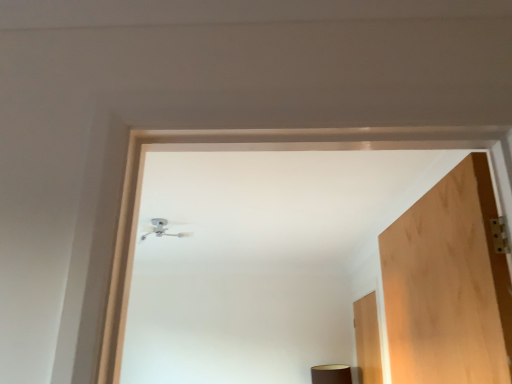
This screenshot has height=384, width=512. Describe the element at coordinates (161, 229) in the screenshot. I see `white metallic ceiling light at upper center` at that location.

You are a GUI agent. You are given a task and a screenshot of the screen. Output one action in this format:
    pyautogui.click(x=<x>, y=<y>)
    Task: Click on the white metallic ceiling light at upper center
    
    Given the screenshot: What is the action you would take?
    pyautogui.click(x=161, y=229)

What is the approximate height of white metallic ceiling light at upper center?

white metallic ceiling light at upper center is 4.21 inches in height.

What do you see at coordinates (367, 340) in the screenshot?
I see `wooden door at right` at bounding box center [367, 340].

What is the approximate height of wooden door at right?

The height of wooden door at right is 28.90 inches.

You are a GUI agent. You are given a task and a screenshot of the screen. Output one action in this format:
    pyautogui.click(x=<x>, y=<y>)
    Task: Click on the wooden door at right
    
    Given the screenshot: What is the action you would take?
    pyautogui.click(x=367, y=340)

You are a GUI agent. You are given a task and a screenshot of the screen. Output one action in this format:
    pyautogui.click(x=<x>, y=<y>)
    Task: Click on the white metallic ceiling light at upper center
    This screenshot has width=512, height=384.
    Given the screenshot: What is the action you would take?
    pos(161,229)

Is white metallic ceiling light at upper center at the right side of wooden door at right?

No, white metallic ceiling light at upper center is not to the right of wooden door at right.

In the image, is white metallic ceiling light at upper center positioned in front of or behind wooden door at right?

white metallic ceiling light at upper center is in front of wooden door at right.

Is point (157, 225) farther from camera compared to point (377, 380)?

No, it is not.

From the image's perspective, is white metallic ceiling light at upper center over wooden door at right?

Indeed, from the image's perspective, white metallic ceiling light at upper center is shown above wooden door at right.

From a real-world perspective, which is physically above, white metallic ceiling light at upper center or wooden door at right?

white metallic ceiling light at upper center, from a real-world perspective.

Which of these two, white metallic ceiling light at upper center or wooden door at right, is wider?

white metallic ceiling light at upper center.

Between white metallic ceiling light at upper center and wooden door at right, which one has more height?

wooden door at right.

Considering the relative sizes of white metallic ceiling light at upper center and wooden door at right in the image provided, is white metallic ceiling light at upper center bigger than wooden door at right?

No.

Is white metallic ceiling light at upper center inside the boundaries of wooden door at right, or outside?

white metallic ceiling light at upper center is outside wooden door at right.

Is white metallic ceiling light at upper center far away from wooden door at right?

Yes, white metallic ceiling light at upper center and wooden door at right are located far from each other.

Could you tell me if white metallic ceiling light at upper center is turned towards wooden door at right?

No, white metallic ceiling light at upper center is not facing towards wooden door at right.

How many degrees apart are the facing directions of white metallic ceiling light at upper center and wooden door at right?

The angular difference between white metallic ceiling light at upper center and wooden door at right is 91 degrees.

How far apart are white metallic ceiling light at upper center and wooden door at right?

The distance of white metallic ceiling light at upper center from wooden door at right is 5.20 feet.

This screenshot has width=512, height=384. In the image, there is a wooden door at right. In order to click on lamp above it (from the image's perspective) in this screenshot , I will do `click(161, 229)`.

Which is more to the right, wooden door at right or white metallic ceiling light at upper center?

Positioned to the right is wooden door at right.

Does wooden door at right lie in front of white metallic ceiling light at upper center?

No, wooden door at right is further to the viewer.

Considering the points (370, 332) and (153, 218), which point is behind, point (370, 332) or point (153, 218)?

Point (370, 332)

Looking at this image, from the image's perspective, which is below, wooden door at right or white metallic ceiling light at upper center?

wooden door at right, from the image's perspective.

Looking at this image, from a real-world perspective, is wooden door at right physically located above or below white metallic ceiling light at upper center?

In terms of real-world spatial position, wooden door at right is below white metallic ceiling light at upper center.

Which of these two, wooden door at right or white metallic ceiling light at upper center, is thinner?

wooden door at right.

Considering the sizes of wooden door at right and white metallic ceiling light at upper center in the image, is wooden door at right taller or shorter than white metallic ceiling light at upper center?

In the image, wooden door at right appears to be taller than white metallic ceiling light at upper center.

Considering the relative sizes of wooden door at right and white metallic ceiling light at upper center in the image provided, is wooden door at right smaller than white metallic ceiling light at upper center?

No, wooden door at right is not smaller than white metallic ceiling light at upper center.

Would you say wooden door at right contains white metallic ceiling light at upper center?

Actually, white metallic ceiling light at upper center is outside wooden door at right.

Are wooden door at right and white metallic ceiling light at upper center far apart?

Yes, wooden door at right and white metallic ceiling light at upper center are located far from each other.

Is wooden door at right looking in the opposite direction of white metallic ceiling light at upper center?

No, white metallic ceiling light at upper center is not at the back of wooden door at right.

How different are the orientations of wooden door at right and white metallic ceiling light at upper center in degrees?

There is a 91-degree angle between the facing directions of wooden door at right and white metallic ceiling light at upper center.

How distant is wooden door at right from white metallic ceiling light at upper center?

A distance of 1.59 meters exists between wooden door at right and white metallic ceiling light at upper center.

Identify the location of lamp in front of the wooden door at right. This screenshot has width=512, height=384. pyautogui.click(x=161, y=229).

Identify the location of door below the white metallic ceiling light at upper center (from a real-world perspective). The image size is (512, 384). (367, 340).

What are the coordinates of `door located below the white metallic ceiling light at upper center (from the image's perspective)` in the screenshot? It's located at (367, 340).